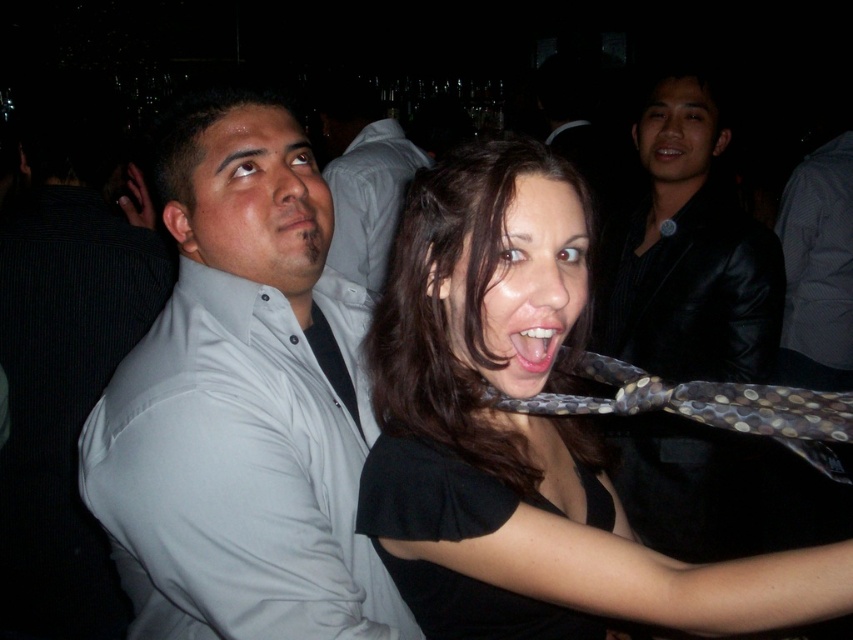
Question: Which object is closer to the camera taking this photo?

Choices:
 (A) smooth white teeth at center
 (B) matte white shirt at upper center

Answer: (A)

Question: Where is polka dot fabric tie at center located in relation to matte white shirt at upper center in the image?

Choices:
 (A) left
 (B) right

Answer: (B)

Question: Which is farther from the gray matte shirt at left?

Choices:
 (A) black leather jacket at upper right
 (B) black matte dress at center
 (C) white matte shirt at left

Answer: (A)

Question: Is black leather jacket at upper right to the left of matte white shirt at upper center from the viewer's perspective?

Choices:
 (A) yes
 (B) no

Answer: (B)

Question: Which point is farther from the camera taking this photo?

Choices:
 (A) (361, 211)
 (B) (552, 316)
 (C) (86, 120)
 (D) (401, 573)

Answer: (A)

Question: Is white matte shirt at left behind polka dot fabric tie at center?

Choices:
 (A) yes
 (B) no

Answer: (A)